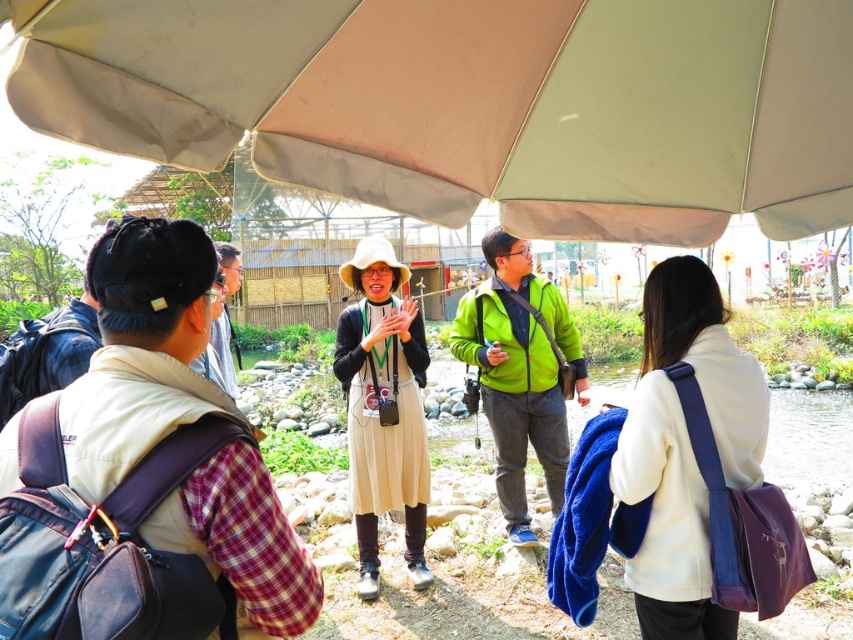
The height and width of the screenshot is (640, 853). Describe the element at coordinates (685, 449) in the screenshot. I see `white fabric coat at lower right` at that location.

Between white fabric coat at lower right and beige fabric dress at center, which one is positioned lower?

beige fabric dress at center is below.

Locate an element on the screen. The width and height of the screenshot is (853, 640). white fabric coat at lower right is located at coordinates (685, 449).

Which is behind, point (589, 56) or point (660, 538)?

The point (589, 56) is more distant.

Which is behind, point (154, 20) or point (654, 412)?

The point (654, 412) is behind.

At what (x,y) coordinates should I click in order to perform the action: click on beige fabric canopy at upper center. Please return your answer as a coordinate pair (x, y). This screenshot has height=640, width=853. Looking at the image, I should click on (473, 104).

Can you confirm if beige fabric canopy at upper center is positioned to the left of beige fabric dress at center?

In fact, beige fabric canopy at upper center is to the right of beige fabric dress at center.

Does beige fabric canopy at upper center have a lesser height compared to beige fabric dress at center?

Yes, beige fabric canopy at upper center is shorter than beige fabric dress at center.

Which is in front, point (822, 10) or point (352, 483)?

Point (822, 10) is more forward.

The image size is (853, 640). Find the location of `beige fabric canopy at upper center`. beige fabric canopy at upper center is located at coordinates (473, 104).